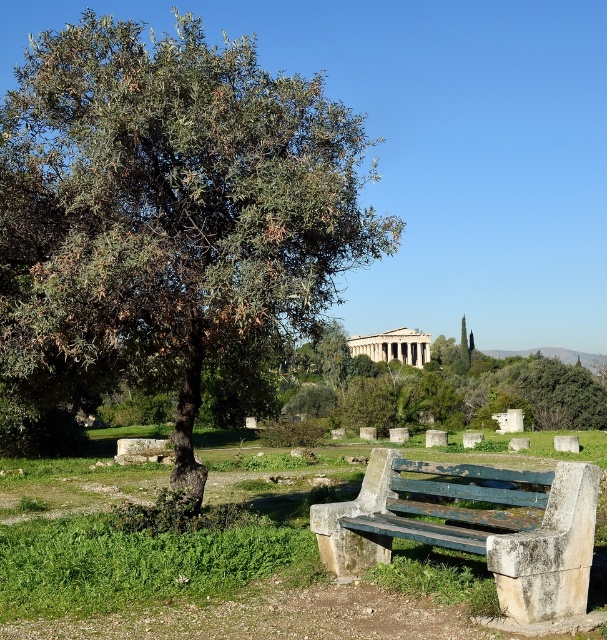
Question: Which of the following is the farthest from the observer?

Choices:
 (A) (548, 403)
 (B) (131, 24)
 (C) (373, 520)

Answer: (A)

Question: Which object is the closest to the green weathered wood bench at lower center?

Choices:
 (A) green leafy olive tree at upper left
 (B) green leafy tree at center

Answer: (A)

Question: Does green leafy olive tree at upper left have a greater width compared to green weathered wood bench at lower center?

Choices:
 (A) yes
 (B) no

Answer: (A)

Question: Can you confirm if green leafy olive tree at upper left is wider than green weathered wood bench at lower center?

Choices:
 (A) yes
 (B) no

Answer: (A)

Question: Does green leafy olive tree at upper left appear on the right side of green weathered wood bench at lower center?

Choices:
 (A) no
 (B) yes

Answer: (A)

Question: Estimate the real-world distances between objects in this image. Which object is farther from the green leafy tree at center?

Choices:
 (A) green weathered wood bench at lower center
 (B) green leafy olive tree at upper left

Answer: (A)